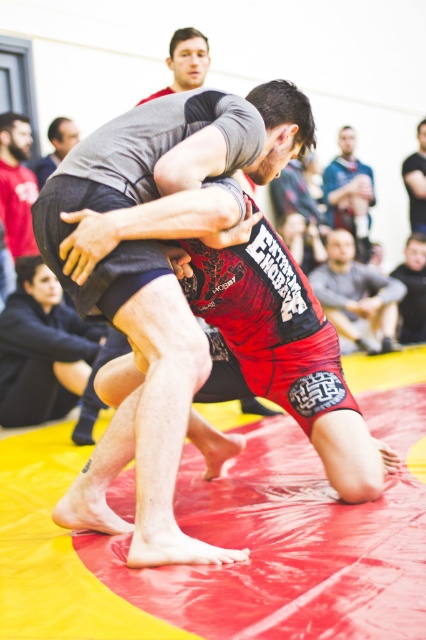
You are a photographer trying to capture a closeup of the red fabric pants at lower right and the blue fabric shirt at upper center. Which object should you zoom in on first to ensure both are in focus?

The red fabric pants at lower right is shorter than the blue fabric shirt at upper center, so you should zoom in on the blue fabric shirt at upper center first to ensure both are in focus.

You are a photographer positioned at the center of the mat. You notice a matte black shirt at left in the image. Can you determine its exact location using coordinates?

The matte black shirt at left is located at point (17, 184).